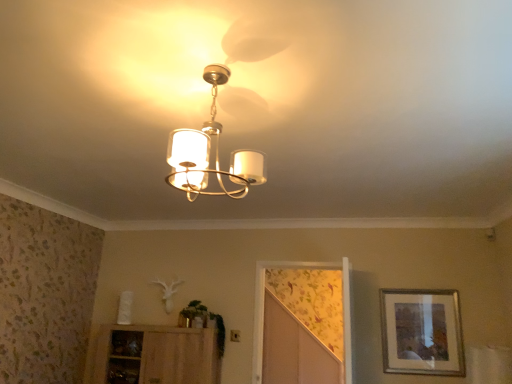
This screenshot has height=384, width=512. What do you see at coordinates (156, 355) in the screenshot?
I see `wooden cabinet at lower left` at bounding box center [156, 355].

Image resolution: width=512 pixels, height=384 pixels. Describe the element at coordinates (209, 153) in the screenshot. I see `matte white chandelier at center` at that location.

Measure the distance between silver metallic picture frame at right and camera.

silver metallic picture frame at right is 10.71 feet away from camera.

Find the location of a particular element. floral wallpaper screen door at center is located at coordinates (294, 350).

Can you confirm if floral wallpaper screen door at center is taller than wooden cabinet at lower left?

Correct, floral wallpaper screen door at center is much taller as wooden cabinet at lower left.

How many degrees apart are the facing directions of floral wallpaper screen door at center and wooden cabinet at lower left?

There is a 1.09-degree angle between the facing directions of floral wallpaper screen door at center and wooden cabinet at lower left.

In the scene shown: Is floral wallpaper screen door at center wider than wooden cabinet at lower left?

In fact, floral wallpaper screen door at center might be narrower than wooden cabinet at lower left.

Is the depth of floral wallpaper screen door at center less than that of wooden cabinet at lower left?

No, floral wallpaper screen door at center is further to the viewer.

Is wooden cabinet at lower left facing away from floral wallpaper screen door at center?

No, wooden cabinet at lower left is not facing away from floral wallpaper screen door at center.

Is wooden cabinet at lower left further to camera compared to floral wallpaper screen door at center?

No, it is in front of floral wallpaper screen door at center.

Measure the distance from silver metallic picture frame at right to wooden cabinet at lower left.

5.87 feet.

Based on the photo, how different are the orientations of silver metallic picture frame at right and wooden cabinet at lower left in degrees?

silver metallic picture frame at right and wooden cabinet at lower left are facing 0.66 degrees away from each other.

Which is behind, point (454, 302) or point (120, 347)?

The point (120, 347) is farther.

From the image's perspective, between silver metallic picture frame at right and wooden cabinet at lower left, which one is located above?

silver metallic picture frame at right appears higher in the image.

Is wooden cabinet at lower left next to matte white chandelier at center?

No, wooden cabinet at lower left is not making contact with matte white chandelier at center.

How many degrees apart are the facing directions of wooden cabinet at lower left and matte white chandelier at center?

180 degrees separate the facing orientations of wooden cabinet at lower left and matte white chandelier at center.

Which object is wider, wooden cabinet at lower left or matte white chandelier at center?

wooden cabinet at lower left.

Is point (120, 356) less distant than point (239, 189)?

That is False.

Looking at this image, from a real-world perspective, is silver metallic picture frame at right above or below floral wallpaper screen door at center?

silver metallic picture frame at right is below floral wallpaper screen door at center.

Looking at this image, is silver metallic picture frame at right to the left of floral wallpaper screen door at center from the viewer's perspective?

In fact, silver metallic picture frame at right is to the right of floral wallpaper screen door at center.

Where is `screen door above the silver metallic picture frame at right (from a real-world perspective)`? screen door above the silver metallic picture frame at right (from a real-world perspective) is located at coordinates (294, 350).

Looking at this image, is silver metallic picture frame at right thinner than floral wallpaper screen door at center?

Correct, the width of silver metallic picture frame at right is less than that of floral wallpaper screen door at center.

Relative to matte white chandelier at center, is floral wallpaper screen door at center in front or behind?

Clearly, floral wallpaper screen door at center is behind matte white chandelier at center.

Would you say floral wallpaper screen door at center is a long distance from matte white chandelier at center?

Yes, floral wallpaper screen door at center is far from matte white chandelier at center.

Image resolution: width=512 pixels, height=384 pixels. I want to click on screen door that appears below the matte white chandelier at center (from the image's perspective), so click(x=294, y=350).

Is floral wallpaper screen door at center to the right of matte white chandelier at center from the viewer's perspective?

Correct, you'll find floral wallpaper screen door at center to the right of matte white chandelier at center.

Would you say wooden cabinet at lower left is a long distance from silver metallic picture frame at right?

wooden cabinet at lower left is far away from silver metallic picture frame at right.

Considering the sizes of objects wooden cabinet at lower left and silver metallic picture frame at right in the image provided, who is shorter, wooden cabinet at lower left or silver metallic picture frame at right?

Standing shorter between the two is wooden cabinet at lower left.

Find the location of a particular element. Image resolution: width=512 pixels, height=384 pixels. picture frame located on the right of wooden cabinet at lower left is located at coordinates (422, 332).

Does wooden cabinet at lower left contain silver metallic picture frame at right?

No, silver metallic picture frame at right is not a part of wooden cabinet at lower left.

This screenshot has height=384, width=512. What are the coordinates of `cabinetry below the floral wallpaper screen door at center (from the image's perspective)` in the screenshot? It's located at coord(156,355).

Identify the location of screen door that appears behind the wooden cabinet at lower left. This screenshot has width=512, height=384. (294, 350).

Based on their spatial positions, is wooden cabinet at lower left or silver metallic picture frame at right closer to matte white chandelier at center?

wooden cabinet at lower left lies closer to matte white chandelier at center than the other object.

When comparing their distances from silver metallic picture frame at right, does wooden cabinet at lower left or floral wallpaper screen door at center seem closer?

Among the two, floral wallpaper screen door at center is located nearer to silver metallic picture frame at right.

Based on their spatial positions, is wooden cabinet at lower left or matte white chandelier at center further from silver metallic picture frame at right?

Among the two, matte white chandelier at center is located further to silver metallic picture frame at right.

Which object lies nearer to the anchor point silver metallic picture frame at right, matte white chandelier at center or floral wallpaper screen door at center?

Based on the image, floral wallpaper screen door at center appears to be nearer to silver metallic picture frame at right.

Based on their spatial positions, is silver metallic picture frame at right or matte white chandelier at center closer to floral wallpaper screen door at center?

Based on the image, silver metallic picture frame at right appears to be nearer to floral wallpaper screen door at center.

Which object lies nearer to the anchor point matte white chandelier at center, silver metallic picture frame at right or wooden cabinet at lower left?

Among the two, wooden cabinet at lower left is located nearer to matte white chandelier at center.

Looking at this image, when comparing their distances from wooden cabinet at lower left, does matte white chandelier at center or silver metallic picture frame at right seem closer?

Among the two, silver metallic picture frame at right is located nearer to wooden cabinet at lower left.

Which object lies nearer to the anchor point wooden cabinet at lower left, floral wallpaper screen door at center or silver metallic picture frame at right?

floral wallpaper screen door at center.

Where is `picture frame located between matte white chandelier at center and floral wallpaper screen door at center in the depth direction`? picture frame located between matte white chandelier at center and floral wallpaper screen door at center in the depth direction is located at coordinates (422, 332).

Find the location of a particular element. cabinetry positioned between matte white chandelier at center and floral wallpaper screen door at center from near to far is located at coordinates (156, 355).

Where is `screen door between wooden cabinet at lower left and silver metallic picture frame at right in the horizontal direction`? Image resolution: width=512 pixels, height=384 pixels. screen door between wooden cabinet at lower left and silver metallic picture frame at right in the horizontal direction is located at coordinates (294, 350).

Find the location of `picture frame between matte white chandelier at center and wooden cabinet at lower left from front to back`. picture frame between matte white chandelier at center and wooden cabinet at lower left from front to back is located at coordinates (422, 332).